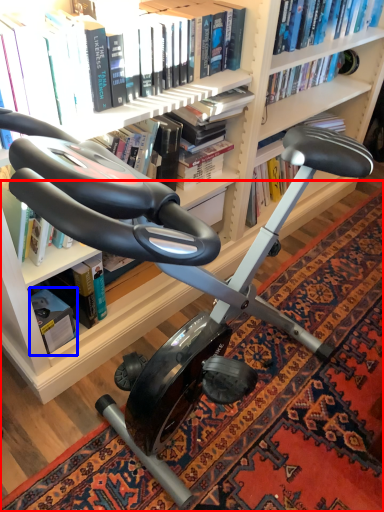
Question: Among these objects, which one is nearest to the camera, mat (highlighted by a red box) or paperback book (highlighted by a blue box)?

Choices:
 (A) mat
 (B) paperback book

Answer: (A)